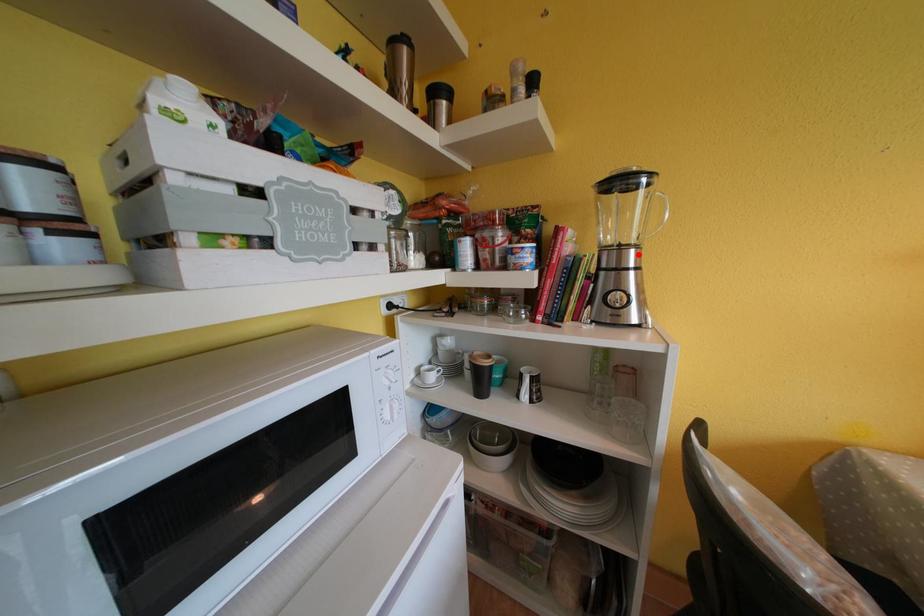
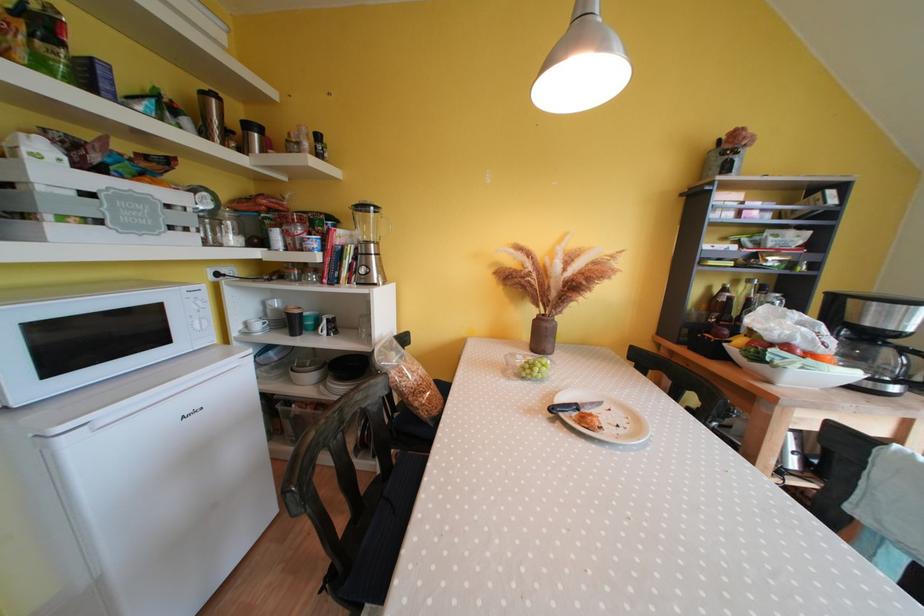
Find the pixel in the second image that matches the highlighted location in the first image.

(379, 249)